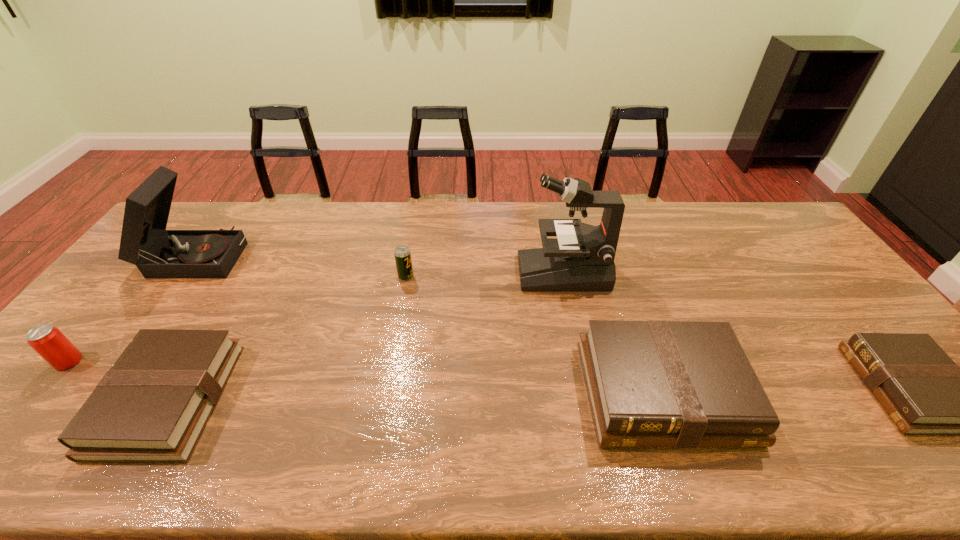
Where is `the leftmost Bible`? the leftmost Bible is located at coordinates (152, 406).

Find the location of a particular element. the second shortest object is located at coordinates (152, 406).

Find the location of a particular element. the second Bible from left to right is located at coordinates (654, 383).

You are a GUI agent. You are given a task and a screenshot of the screen. Output one action in this format:
    pyautogui.click(x=<x>, y=<y>)
    Task: Click on the phonograph_record
    This screenshot has width=960, height=540.
    Given the screenshot: What is the action you would take?
    tap(158, 253)

Image resolution: width=960 pixels, height=540 pixels. I want to click on microscope, so click(x=581, y=258).

The image size is (960, 540). I want to click on can, so click(x=49, y=342).

Identify the location of beer can. (402, 254).

Locate an element on the screen. vacant space located on the spine side of the leftmost Bible is located at coordinates (61, 399).

Where is `vacant region located 0.130m on the spine side of the leftmost Bible`? vacant region located 0.130m on the spine side of the leftmost Bible is located at coordinates (61, 399).

You are a GUI agent. You are given a task and a screenshot of the screen. Output one action in this format:
    pyautogui.click(x=<x>, y=<y>)
    Task: Click on the free space located on the spine side of the leftmost Bible
    The height and width of the screenshot is (540, 960).
    Given the screenshot: What is the action you would take?
    pyautogui.click(x=33, y=399)